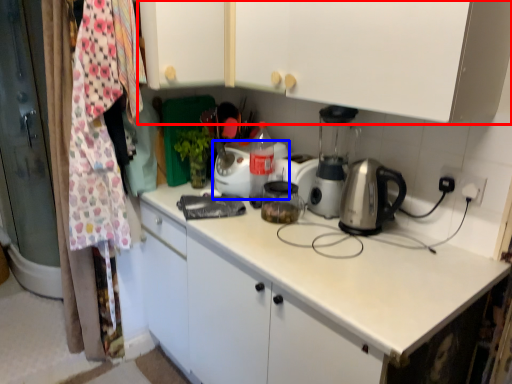
Question: Which object is closer to the camera taking this photo, cabinetry (highlighted by a red box) or kitchen appliance (highlighted by a blue box)?

Choices:
 (A) cabinetry
 (B) kitchen appliance

Answer: (A)